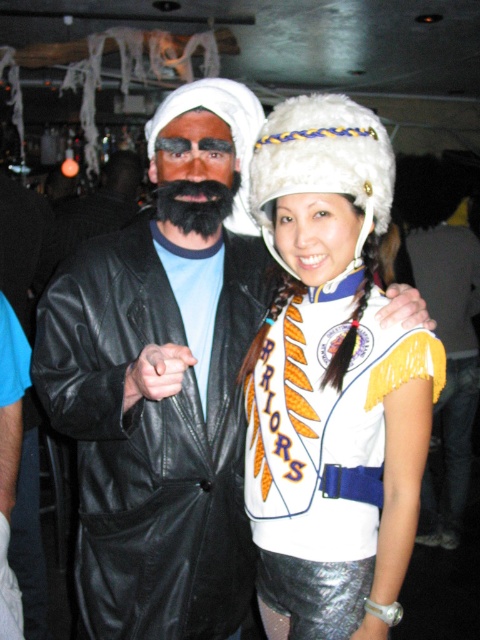
You are standing in front of a group photo from a costume party. You see two hats in the image. The first is a white fur hat at upper center, and the second is a white fuzzy hat at center. Which hat is positioned closer to you?

The white fur hat at upper center is closer to the viewer than the white fuzzy hat at center.

You are a photographer at a costume party. You need to place a decorative light at point (332, 381). Which costume element will the light be placed on?

The point (332, 381) is on the white fur hat at upper center, so the decorative light will be placed on the white fur hat at upper center.

You are standing in front of the image and want to locate the white fuzzy hat at center. Where is it positioned in terms of coordinates?

The white fuzzy hat at center is positioned at coordinates point [228,128].